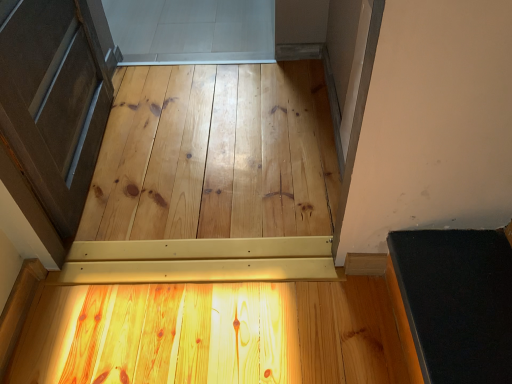
Measure the distance between natural wood plywood at center, the first plywood when ordered from back to front, and camera.

1.35 meters.

Measure the distance between point (274, 91) and camera.

The depth of point (274, 91) is 1.92 meters.

Identify the location of natural wood plywood at center, the first plywood when ordered from back to front. The width and height of the screenshot is (512, 384). (215, 155).

Describe the element at coordinates (215, 155) in the screenshot. I see `natural wood plywood at center, which is the 1th plywood from top to bottom` at that location.

Describe the element at coordinates (213, 334) in the screenshot. I see `light brown polished wood at center, the 1th plywood when ordered from bottom to top` at that location.

Locate an element on the screen. light brown polished wood at center, which is counted as the 2th plywood, starting from the back is located at coordinates (213, 334).

The width and height of the screenshot is (512, 384). What are the coordinates of `natural wood plywood at center, the first plywood when ordered from back to front` in the screenshot? It's located at (215, 155).

Does natural wood plywood at center, the first plywood when ordered from back to front, appear on the right side of light brown polished wood at center, which is counted as the 2th plywood, starting from the back?

No, natural wood plywood at center, the first plywood when ordered from back to front, is not to the right of light brown polished wood at center, which is counted as the 2th plywood, starting from the back.

Considering their positions, is natural wood plywood at center, which is the 1th plywood from top to bottom, located in front of or behind light brown polished wood at center, the first plywood in the front-to-back sequence?

In the image, natural wood plywood at center, which is the 1th plywood from top to bottom, appears behind light brown polished wood at center, the first plywood in the front-to-back sequence.

Which is more distant, (300, 80) or (86, 327)?

The point (300, 80) is more distant.

From the image's perspective, is natural wood plywood at center, marked as the second plywood in a bottom-to-top arrangement, on top of light brown polished wood at center, the 2th plywood from the top?

Indeed, from the image's perspective, natural wood plywood at center, marked as the second plywood in a bottom-to-top arrangement, is shown above light brown polished wood at center, the 2th plywood from the top.

From a real-world perspective, is natural wood plywood at center, marked as the second plywood in a bottom-to-top arrangement, physically above light brown polished wood at center, the 1th plywood when ordered from bottom to top?

No, from a real-world perspective, natural wood plywood at center, marked as the second plywood in a bottom-to-top arrangement, is not on top of light brown polished wood at center, the 1th plywood when ordered from bottom to top.

Can you confirm if natural wood plywood at center, which is the second plywood from front to back, is thinner than light brown polished wood at center, the first plywood in the front-to-back sequence?

No.

Consider the image. Considering the relative sizes of natural wood plywood at center, marked as the second plywood in a bottom-to-top arrangement, and light brown polished wood at center, which is counted as the 2th plywood, starting from the back, in the image provided, is natural wood plywood at center, marked as the second plywood in a bottom-to-top arrangement, taller than light brown polished wood at center, which is counted as the 2th plywood, starting from the back,?

Incorrect, the height of natural wood plywood at center, marked as the second plywood in a bottom-to-top arrangement, is not larger of that of light brown polished wood at center, which is counted as the 2th plywood, starting from the back.

Looking at this image, which of these two, natural wood plywood at center, which is the second plywood from front to back, or light brown polished wood at center, the 2th plywood from the top, is smaller?

light brown polished wood at center, the 2th plywood from the top.

Is natural wood plywood at center, which is the second plywood from front to back, outside of light brown polished wood at center, the 1th plywood when ordered from bottom to top?

That's correct, natural wood plywood at center, which is the second plywood from front to back, is outside of light brown polished wood at center, the 1th plywood when ordered from bottom to top.

Looking at this image, is natural wood plywood at center, which is the 1th plywood from top to bottom, placed right next to light brown polished wood at center, the 2th plywood from the top?

natural wood plywood at center, which is the 1th plywood from top to bottom, and light brown polished wood at center, the 2th plywood from the top, are clearly separated.

Is light brown polished wood at center, the first plywood in the front-to-back sequence, at the back of natural wood plywood at center, which is the 1th plywood from top to bottom?

Absolutely, natural wood plywood at center, which is the 1th plywood from top to bottom, is directed away from light brown polished wood at center, the first plywood in the front-to-back sequence.

Can you tell me how much natural wood plywood at center, which is the 1th plywood from top to bottom, and light brown polished wood at center, the 2th plywood from the top, differ in facing direction?

The angle between the facing direction of natural wood plywood at center, which is the 1th plywood from top to bottom, and the facing direction of light brown polished wood at center, the 2th plywood from the top, is 4.28e-05 degrees.

The width and height of the screenshot is (512, 384). In order to click on plywood on the right of natural wood plywood at center, the first plywood when ordered from back to front in this screenshot , I will do [213, 334].

Visually, is light brown polished wood at center, the 2th plywood from the top, positioned to the left or to the right of natural wood plywood at center, marked as the second plywood in a bottom-to-top arrangement?

Clearly, light brown polished wood at center, the 2th plywood from the top, is on the right of natural wood plywood at center, marked as the second plywood in a bottom-to-top arrangement, in the image.

Is light brown polished wood at center, the first plywood in the front-to-back sequence, further to the viewer compared to natural wood plywood at center, which is the second plywood from front to back?

No, the depth of light brown polished wood at center, the first plywood in the front-to-back sequence, is less than that of natural wood plywood at center, which is the second plywood from front to back.

Is point (181, 355) farther from camera compared to point (229, 123)?

No, (181, 355) is closer to viewer.

Looking at this image, from the image's perspective, relative to natural wood plywood at center, the first plywood when ordered from back to front, is light brown polished wood at center, the first plywood in the front-to-back sequence, above or below?

From the image's perspective, light brown polished wood at center, the first plywood in the front-to-back sequence, appears below natural wood plywood at center, the first plywood when ordered from back to front.

From a real-world perspective, which object rests below the other?

From a 3D spatial view, natural wood plywood at center, which is the second plywood from front to back, is below.

Considering the relative sizes of light brown polished wood at center, the first plywood in the front-to-back sequence, and natural wood plywood at center, marked as the second plywood in a bottom-to-top arrangement, in the image provided, is light brown polished wood at center, the first plywood in the front-to-back sequence, wider than natural wood plywood at center, marked as the second plywood in a bottom-to-top arrangement,?

No.

Considering the relative sizes of light brown polished wood at center, the first plywood in the front-to-back sequence, and natural wood plywood at center, which is the second plywood from front to back, in the image provided, is light brown polished wood at center, the first plywood in the front-to-back sequence, taller than natural wood plywood at center, which is the second plywood from front to back,?

Correct, light brown polished wood at center, the first plywood in the front-to-back sequence, is much taller as natural wood plywood at center, which is the second plywood from front to back.

Considering the sizes of objects light brown polished wood at center, the 2th plywood from the top, and natural wood plywood at center, which is the 1th plywood from top to bottom, in the image provided, who is bigger, light brown polished wood at center, the 2th plywood from the top, or natural wood plywood at center, which is the 1th plywood from top to bottom,?

natural wood plywood at center, which is the 1th plywood from top to bottom, is bigger.

Can we say light brown polished wood at center, the 1th plywood when ordered from bottom to top, lies outside natural wood plywood at center, which is the 1th plywood from top to bottom?

That's correct, light brown polished wood at center, the 1th plywood when ordered from bottom to top, is outside of natural wood plywood at center, which is the 1th plywood from top to bottom.

Are light brown polished wood at center, which is counted as the 2th plywood, starting from the back, and natural wood plywood at center, the first plywood when ordered from back to front, beside each other?

No, light brown polished wood at center, which is counted as the 2th plywood, starting from the back, is not making contact with natural wood plywood at center, the first plywood when ordered from back to front.

Is light brown polished wood at center, the 1th plywood when ordered from bottom to top, positioned with its back to natural wood plywood at center, which is the second plywood from front to back?

No, light brown polished wood at center, the 1th plywood when ordered from bottom to top, is not facing away from natural wood plywood at center, which is the second plywood from front to back.

Can you tell me how much light brown polished wood at center, which is counted as the 2th plywood, starting from the back, and natural wood plywood at center, marked as the second plywood in a bottom-to-top arrangement, differ in facing direction?

The angle between the facing direction of light brown polished wood at center, which is counted as the 2th plywood, starting from the back, and the facing direction of natural wood plywood at center, marked as the second plywood in a bottom-to-top arrangement, is 4.28e-05 degrees.

This screenshot has width=512, height=384. I want to click on plywood lying in front of the natural wood plywood at center, the first plywood when ordered from back to front, so click(213, 334).

The width and height of the screenshot is (512, 384). In order to click on plywood that is behind the light brown polished wood at center, the 2th plywood from the top in this screenshot , I will do `click(215, 155)`.

Find the location of a particular element. The image size is (512, 384). plywood above the light brown polished wood at center, the first plywood in the front-to-back sequence (from the image's perspective) is located at coordinates coord(215,155).